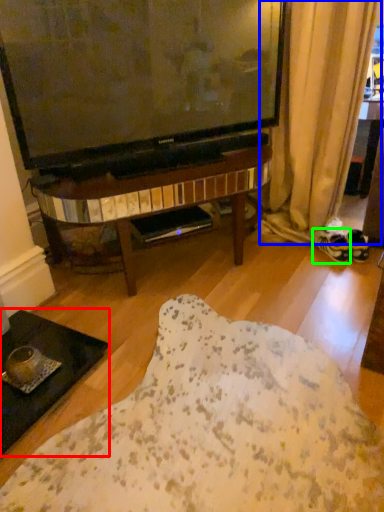
Question: Which is farther away from coffee table (highlighted by a red box)? curtain (highlighted by a blue box) or footwear (highlighted by a green box)?

Choices:
 (A) curtain
 (B) footwear

Answer: (A)